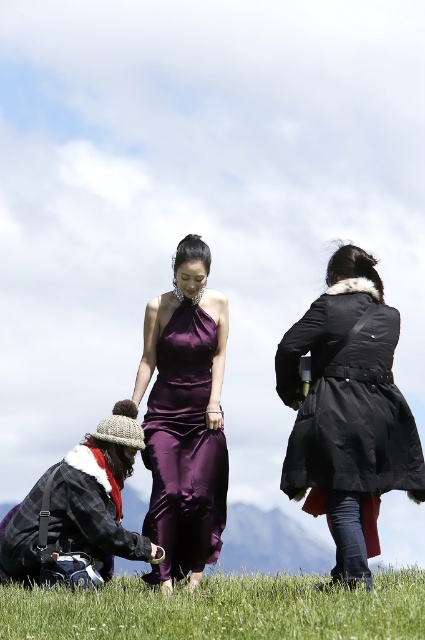
You are a photographer setting up a shot of the scene described. You need to ensure that the green grass at lower center and the black matte coat at center are both visible in the frame. Given their height difference, which object might require you to adjust your camera angle to include it properly?

The green grass at lower center is shorter than the black matte coat at center, so you might need to lower your camera angle to ensure the grass is visible while still capturing the coat.

You are a photographer planning to capture a closeup of the satin purple dress at center. Considering the green grass at lower center, will the grass be wider than the dress in the frame?

The green grass at lower center has a larger width than the satin purple dress at center, so yes, the grass will be wider than the dress in the frame.

You are a photographer trying to capture the scene described. You need to place a tripod at the exact center of the image. However, you must ensure that the tripod does not block the view of the black matte coat at center. Based on the coordinates provided, where should you position the tripod to avoid blocking the coat?

The black matte coat at center is located at point (348, 397). To avoid blocking it, the tripod should be placed away from this coordinate, perhaps at the true center coordinates of (212, 320) if the coordinate system is normalized.